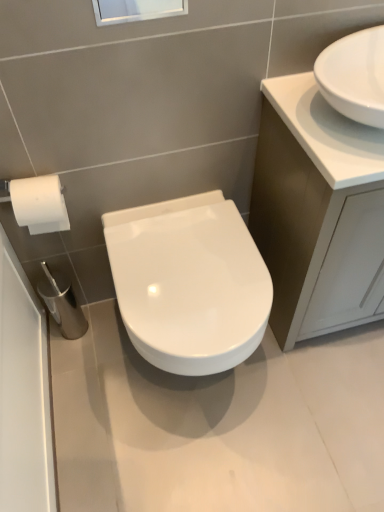
The height and width of the screenshot is (512, 384). Find the location of `free spot to the right of white glossy toilet at center`. free spot to the right of white glossy toilet at center is located at coordinates (322, 393).